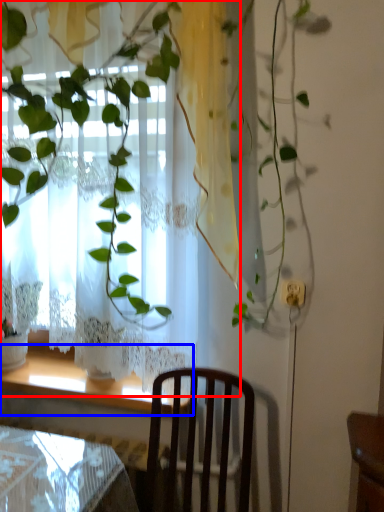
Question: Which of the following is the farthest to the observer, curtain (highlighted by a red box) or window sill (highlighted by a blue box)?

Choices:
 (A) curtain
 (B) window sill

Answer: (B)